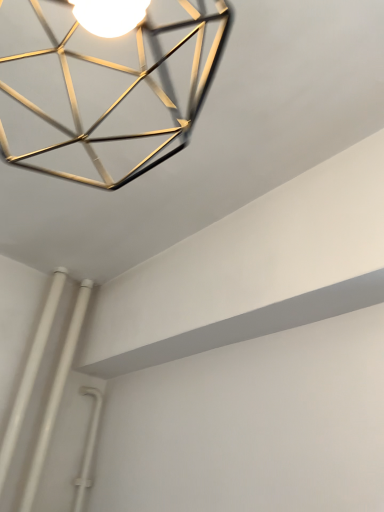
Question: From the image's perspective, is white plastic pipes at lower left on top of gold metallic geometric frame at upper center?

Choices:
 (A) no
 (B) yes

Answer: (A)

Question: Can you confirm if white plastic pipes at lower left is shorter than gold metallic geometric frame at upper center?

Choices:
 (A) yes
 (B) no

Answer: (B)

Question: Is white plastic pipes at lower left wider than gold metallic geometric frame at upper center?

Choices:
 (A) yes
 (B) no

Answer: (B)

Question: From a real-world perspective, is white plastic pipes at lower left positioned over gold metallic geometric frame at upper center based on gravity?

Choices:
 (A) yes
 (B) no

Answer: (B)

Question: Considering the relative sizes of white plastic pipes at lower left and gold metallic geometric frame at upper center in the image provided, is white plastic pipes at lower left taller than gold metallic geometric frame at upper center?

Choices:
 (A) yes
 (B) no

Answer: (A)

Question: Could you tell me if white plastic pipes at lower left is facing gold metallic geometric frame at upper center?

Choices:
 (A) no
 (B) yes

Answer: (A)

Question: Can you confirm if gold metallic geometric frame at upper center is wider than white plastic pipes at lower left?

Choices:
 (A) no
 (B) yes

Answer: (B)

Question: Is gold metallic geometric frame at upper center closer to camera compared to white plastic pipes at lower left?

Choices:
 (A) yes
 (B) no

Answer: (A)

Question: Is gold metallic geometric frame at upper center at the right side of white plastic pipes at lower left?

Choices:
 (A) no
 (B) yes

Answer: (B)

Question: Can you confirm if gold metallic geometric frame at upper center is shorter than white plastic pipes at lower left?

Choices:
 (A) no
 (B) yes

Answer: (B)

Question: Is gold metallic geometric frame at upper center oriented away from white plastic pipes at lower left?

Choices:
 (A) yes
 (B) no

Answer: (B)

Question: Is gold metallic geometric frame at upper center far from white plastic pipes at lower left?

Choices:
 (A) no
 (B) yes

Answer: (A)

Question: Looking at the image, does white plastic pipes at lower left seem bigger or smaller compared to gold metallic geometric frame at upper center?

Choices:
 (A) small
 (B) big

Answer: (A)